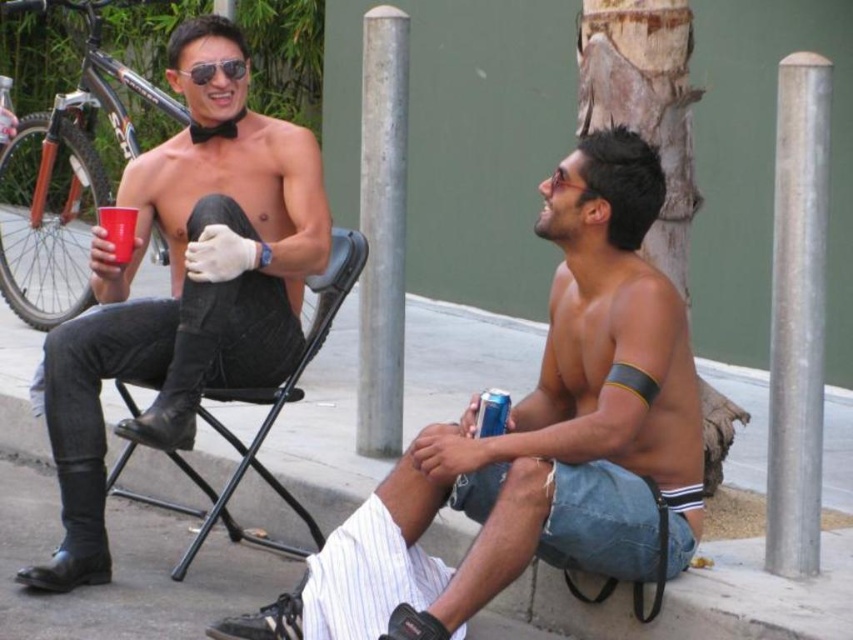
Who is more forward, (805, 125) or (120, 243)?

Point (805, 125) is in front.

Is silver metallic pole at center right below red plastic cup at left?

Yes.

The width and height of the screenshot is (853, 640). What do you see at coordinates (798, 316) in the screenshot?
I see `silver metallic pole at center right` at bounding box center [798, 316].

This screenshot has width=853, height=640. What are the coordinates of `silver metallic pole at center right` in the screenshot? It's located at (798, 316).

Who is taller, smooth skin torso at center or red plastic cup at left?

With more height is smooth skin torso at center.

Between smooth skin torso at center and red plastic cup at left, which one has less height?

red plastic cup at left is shorter.

Where is `smooth skin torso at center`? The image size is (853, 640). smooth skin torso at center is located at coordinates (561, 420).

Is silver metallic pole at center wider than black leather chair at center?

Incorrect, silver metallic pole at center's width does not surpass black leather chair at center's.

Is silver metallic pole at center below black leather chair at center?

No, silver metallic pole at center is not below black leather chair at center.

Is point (398, 218) positioned in front of point (274, 396)?

No.

You are a GUI agent. You are given a task and a screenshot of the screen. Output one action in this format:
    pyautogui.click(x=<x>, y=<y>)
    Task: Click on the silver metallic pole at center
    
    Given the screenshot: What is the action you would take?
    pyautogui.click(x=381, y=230)